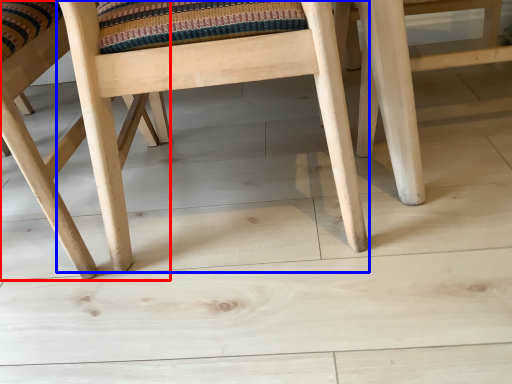
Question: Which object appears farthest to the camera in this image, chair (highlighted by a red box) or chair (highlighted by a blue box)?

Choices:
 (A) chair
 (B) chair

Answer: (A)